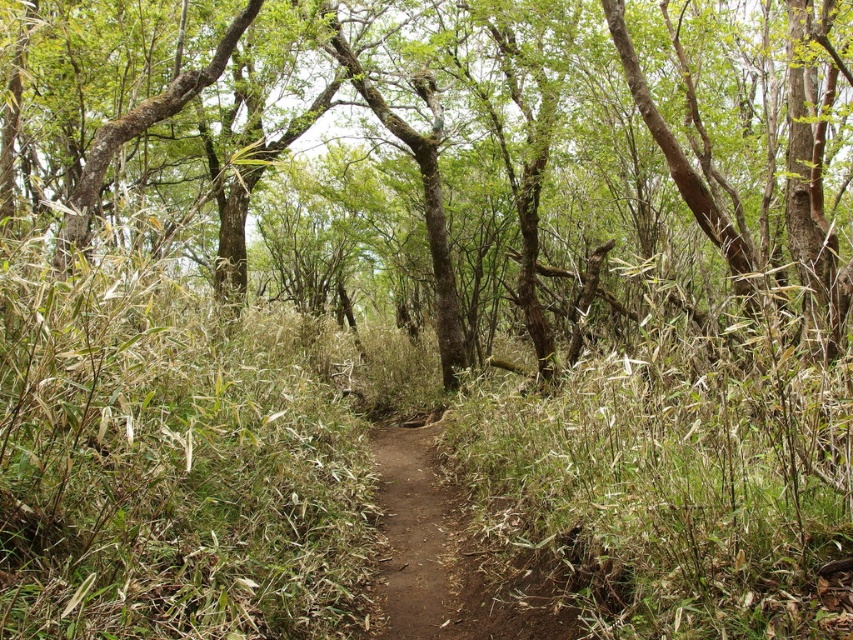
Who is shorter, green bark tree at center or brown dirt path at center?

With less height is brown dirt path at center.

Is green bark tree at center above brown dirt path at center?

Yes.

Locate an element on the screen. green bark tree at center is located at coordinates (454, 120).

The height and width of the screenshot is (640, 853). Identify the location of green bark tree at center. (454, 120).